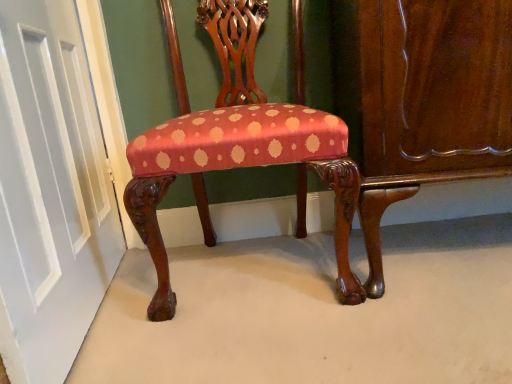
Where is `vacant area located to the right-hand side of white painted wood door at left`? The image size is (512, 384). vacant area located to the right-hand side of white painted wood door at left is located at coordinates (203, 328).